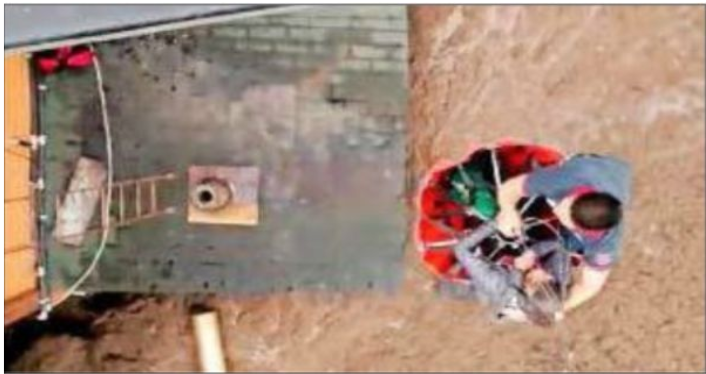
Identify the location of ladder. (131, 211).